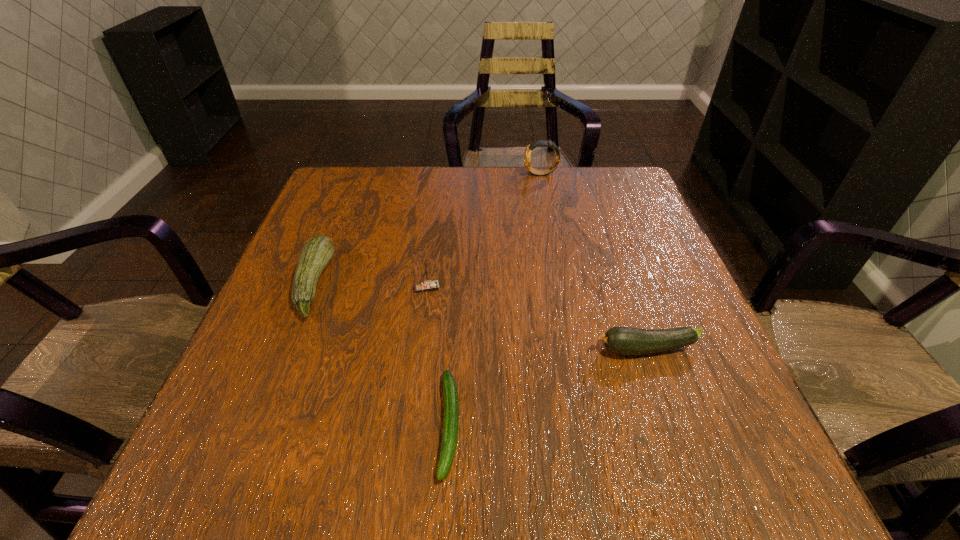
The width and height of the screenshot is (960, 540). In order to click on watch in this screenshot , I will do `click(527, 155)`.

Image resolution: width=960 pixels, height=540 pixels. In order to click on matchbox in this screenshot , I will do `click(425, 286)`.

Locate an element on the screen. the farthest zucchini is located at coordinates (318, 251).

Identify the location of the leftmost zucchini. The image size is (960, 540). (318, 251).

Where is `the second farthest zucchini`? the second farthest zucchini is located at coordinates (619, 340).

You are a GUI agent. You are given a task and a screenshot of the screen. Output one action in this format:
    pyautogui.click(x=<x>, y=<y>)
    Task: Click on the fourth farthest object
    
    Given the screenshot: What is the action you would take?
    pyautogui.click(x=619, y=340)

Image resolution: width=960 pixels, height=540 pixels. I want to click on the shortest object, so click(x=451, y=401).

At what (x,y) coordinates should I click in order to perform the action: click on the third object from left to right. Please return your answer as a coordinate pair (x, y). The image size is (960, 540). Looking at the image, I should click on (451, 401).

Where is `free space located on the face of the watch`? This screenshot has height=540, width=960. free space located on the face of the watch is located at coordinates (392, 174).

This screenshot has width=960, height=540. In order to click on vacant area situated on the face of the watch in this screenshot , I will do `click(437, 174)`.